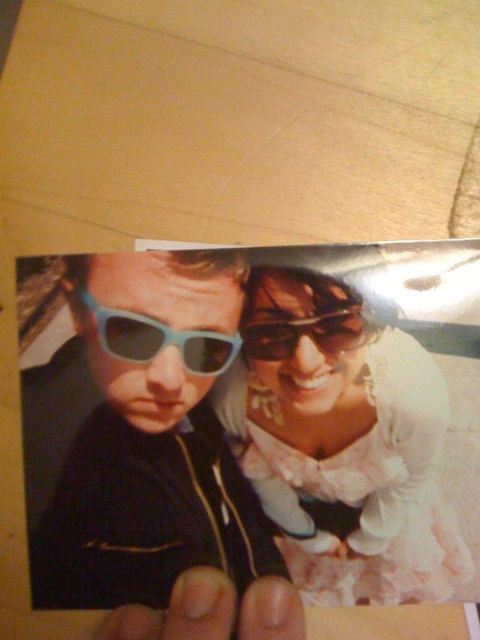
Question: Which object is closer to the camera taking this photo?

Choices:
 (A) teal plastic goggles at center
 (B) matte white dress at center

Answer: (B)

Question: In this image, where is matte plastic sunglasses at left located relative to nail at lower center?

Choices:
 (A) left
 (B) right

Answer: (A)

Question: Can you confirm if matte plastic sunglasses at left is positioned to the right of matte plastic sunglasses at upper center?

Choices:
 (A) yes
 (B) no

Answer: (B)

Question: Is matte plastic sunglasses at left to the right of matte white dress at center from the viewer's perspective?

Choices:
 (A) no
 (B) yes

Answer: (A)

Question: Which point appears farthest from the camera in this image?

Choices:
 (A) (85, 296)
 (B) (263, 636)

Answer: (A)

Question: Which object is positioned closest to the matte plastic sunglasses at left?

Choices:
 (A) nail at lower center
 (B) teal plastic goggles at center
 (C) matte white dress at center

Answer: (C)